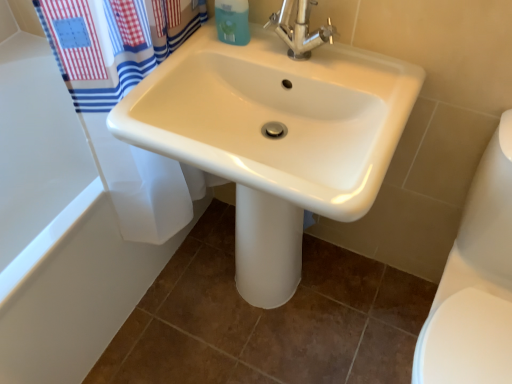
You are a GUI agent. You are given a task and a screenshot of the screen. Output one action in this format:
    pyautogui.click(x=<x>, y=<y>)
    Task: Click on the vacant area to the left of blue matte soap dispenser at upper center
    This screenshot has width=512, height=384.
    Given the screenshot: What is the action you would take?
    pyautogui.click(x=197, y=46)